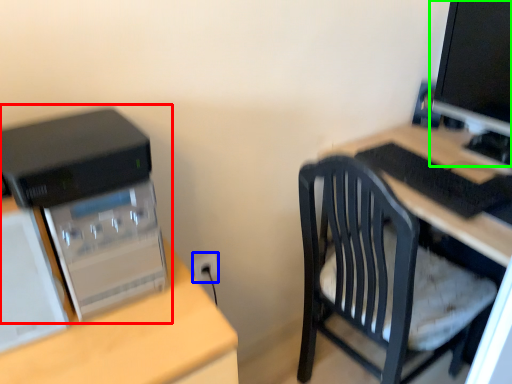
Question: Which is nearer to the computer tower (highlighted by a red box)? electric outlet (highlighted by a blue box) or computer monitor (highlighted by a green box).

Choices:
 (A) electric outlet
 (B) computer monitor

Answer: (A)